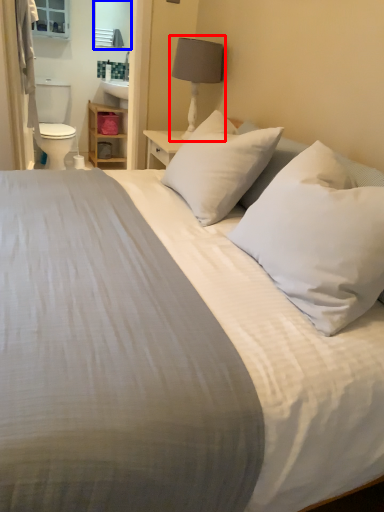
Question: Among these objects, which one is nearest to the camera, bedside lamp (highlighted by a red box) or mirror (highlighted by a blue box)?

Choices:
 (A) bedside lamp
 (B) mirror

Answer: (A)